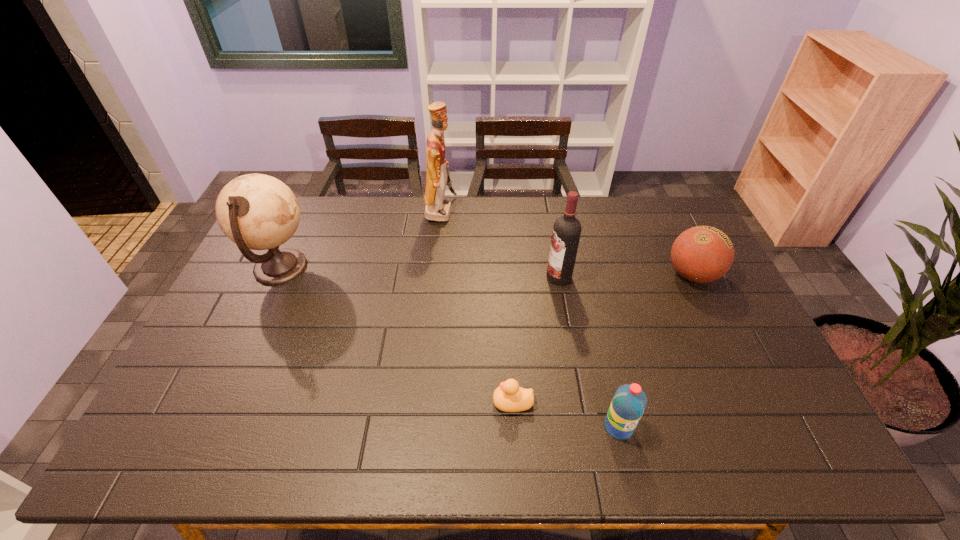
The image size is (960, 540). In order to click on vacant area between the water bottle and the globe in this screenshot , I will do `click(449, 347)`.

I want to click on empty space that is in between the fifth object from right to left and the duck, so click(x=477, y=307).

The height and width of the screenshot is (540, 960). In order to click on free space that is in between the leftmost object and the farthest object in this screenshot , I will do pos(361,240).

Locate an element on the screen. This screenshot has width=960, height=540. vacant space that is in between the third object from right to left and the fifth object from left to right is located at coordinates (588, 352).

The height and width of the screenshot is (540, 960). In order to click on free space between the leftmost object and the rightmost object in this screenshot , I will do `click(487, 272)`.

This screenshot has width=960, height=540. Find the location of `vacant space in between the wine bottle and the duck`. vacant space in between the wine bottle and the duck is located at coordinates (536, 340).

Locate which object ranks second in proximity to the fifth object from left to right. Please provide its 2D coordinates. Your answer should be formatted as a tuple, i.e. [(x, y)], where the tuple contains the x and y coordinates of a point satisfying the conditions above.

[(566, 233)]

Identify which object is the second nearest to the basketball. Please provide its 2D coordinates. Your answer should be formatted as a tuple, i.e. [(x, y)], where the tuple contains the x and y coordinates of a point satisfying the conditions above.

[(629, 402)]

Find the location of `vacant area in the image that satisfies the following two spatial constraints: 1. on the front-facing side of the basketball; 2. on the right side of the fifth object from right to left`. vacant area in the image that satisfies the following two spatial constraints: 1. on the front-facing side of the basketball; 2. on the right side of the fifth object from right to left is located at coordinates (435, 275).

Find the location of a particular element. This screenshot has width=960, height=540. vacant space that satisfies the following two spatial constraints: 1. on the front-facing side of the globe; 2. on the right side of the rightmost object is located at coordinates (277, 275).